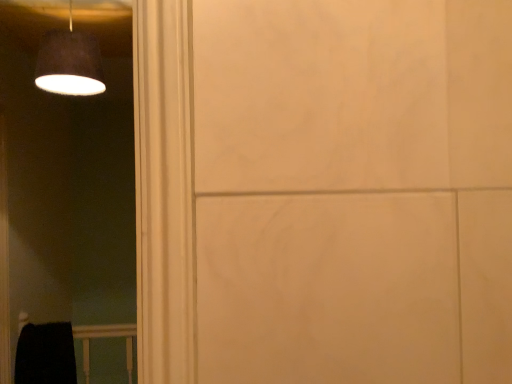
Question: Is point (87, 342) positioned closer to the camera than point (45, 54)?

Choices:
 (A) farther
 (B) closer

Answer: (A)

Question: Based on their positions, is black matte balustrade at lower left located to the left or right of matte black lampshade at upper left?

Choices:
 (A) right
 (B) left

Answer: (B)

Question: Is black matte balustrade at lower left spatially inside matte black lampshade at upper left, or outside of it?

Choices:
 (A) inside
 (B) outside

Answer: (B)

Question: Does point (53, 38) appear closer or farther from the camera than point (59, 359)?

Choices:
 (A) farther
 (B) closer

Answer: (B)

Question: From a real-world perspective, is matte black lampshade at upper left positioned above or below black matte balustrade at lower left?

Choices:
 (A) below
 (B) above

Answer: (B)

Question: In terms of height, does matte black lampshade at upper left look taller or shorter compared to black matte balustrade at lower left?

Choices:
 (A) short
 (B) tall

Answer: (A)

Question: From the image's perspective, is matte black lampshade at upper left above or below black matte balustrade at lower left?

Choices:
 (A) below
 (B) above

Answer: (B)